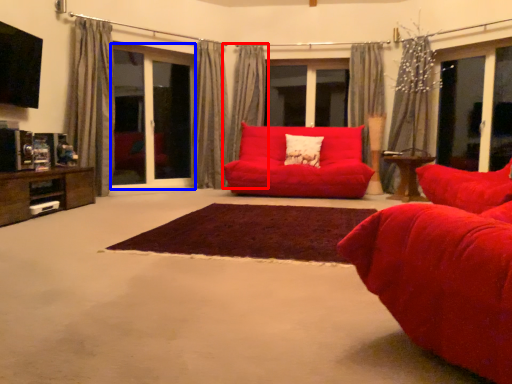
Question: Which object appears closest to the camera in this image, curtain (highlighted by a red box) or screen door (highlighted by a blue box)?

Choices:
 (A) curtain
 (B) screen door

Answer: (B)